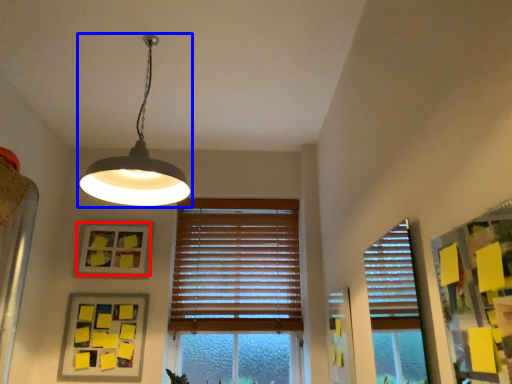
Question: Among these objects, which one is farthest to the camera, picture frame (highlighted by a red box) or lamp (highlighted by a blue box)?

Choices:
 (A) picture frame
 (B) lamp

Answer: (A)